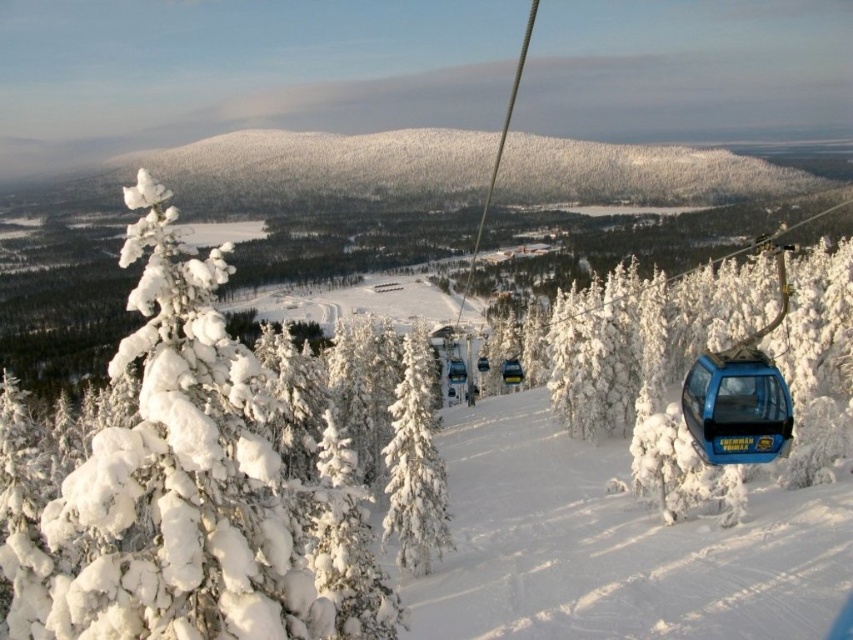
Question: Can you confirm if white snow-covered tree at center-left is positioned below blue glossy cable car at center-right?

Choices:
 (A) no
 (B) yes

Answer: (B)

Question: Which point appears farthest from the camera in this image?

Choices:
 (A) (505, 384)
 (B) (392, 444)
 (C) (154, 186)

Answer: (A)

Question: Which of these objects is positioned farthest from the blue glossy gondola at right?

Choices:
 (A) blue glossy cable car at center-right
 (B) blue metallic gondola at center

Answer: (B)

Question: Which of the following is the farthest from the observer?

Choices:
 (A) blue metallic gondola at center
 (B) white snow-covered tree at center-left

Answer: (A)

Question: Where is blue glossy gondola at right located in relation to blue glossy cable car at center-right in the image?

Choices:
 (A) above
 (B) below

Answer: (B)

Question: Does white snow-covered tree at center-left appear on the left side of blue glossy cable car at center-right?

Choices:
 (A) yes
 (B) no

Answer: (A)